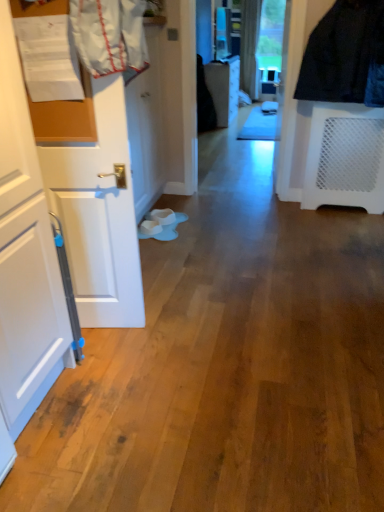
This screenshot has height=512, width=384. Find the location of `vacant area to the right of white matte door at left, positioned as the 1th door in front-to-back order`. vacant area to the right of white matte door at left, positioned as the 1th door in front-to-back order is located at coordinates (169, 328).